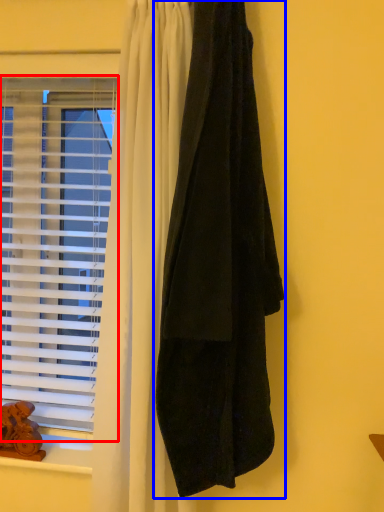
Question: Which of the following is the closest to the observer, window (highlighted by a red box) or curtain (highlighted by a blue box)?

Choices:
 (A) window
 (B) curtain

Answer: (B)